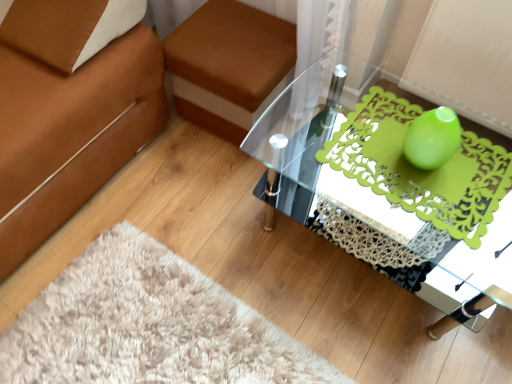
Where is `blank space above brown fabric footrest at upper center (from a real-world perspective)`? The image size is (512, 384). blank space above brown fabric footrest at upper center (from a real-world perspective) is located at coordinates (246, 41).